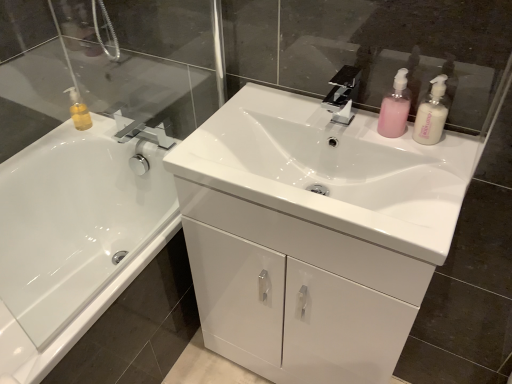
Identify the location of free space that is to the left of black glossy faucet at center. (280, 112).